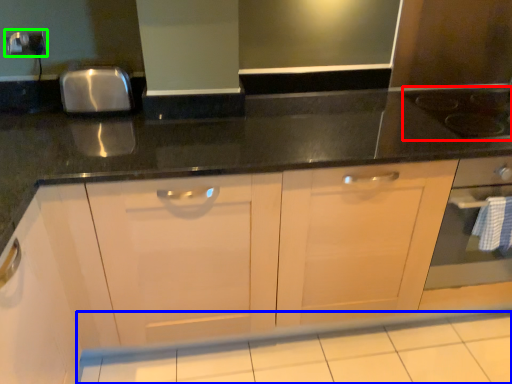
Question: Which object is the closest to the gas stove (highlighted by a red box)? Choose among these: tile (highlighted by a blue box) or electric outlet (highlighted by a green box).

Choices:
 (A) tile
 (B) electric outlet

Answer: (A)